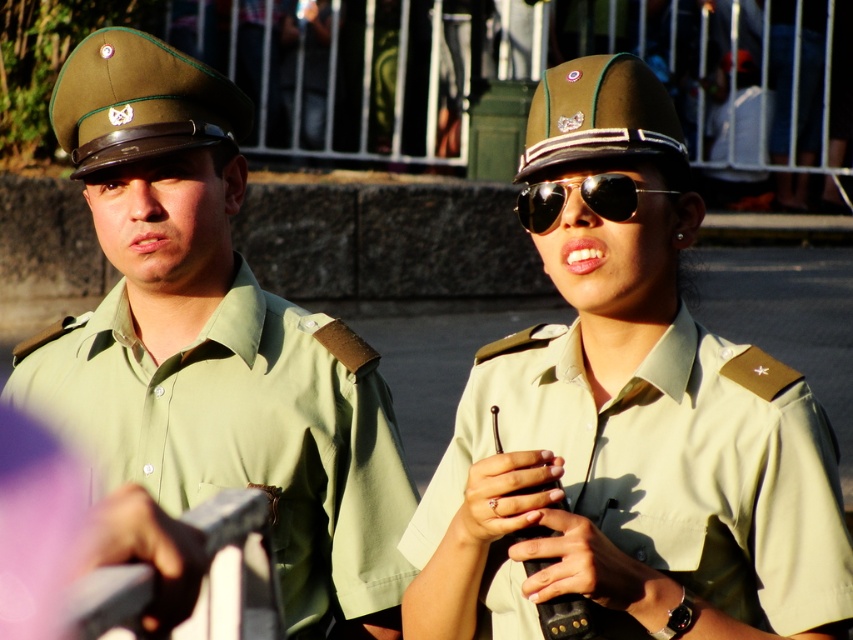
Question: Which point appears closest to the camera in this image?

Choices:
 (A) (543, 432)
 (B) (54, 408)

Answer: (A)

Question: Can you confirm if green uniform shirt at left is positioned to the right of khaki fabric uniform at right?

Choices:
 (A) yes
 (B) no

Answer: (B)

Question: Which point is farther to the camera?

Choices:
 (A) (318, 374)
 (B) (527, 227)
 (C) (509, 380)

Answer: (A)

Question: Which object is positioned closest to the khaki fabric uniform at right?

Choices:
 (A) gold reflective sunglasses at center
 (B) green uniform shirt at left

Answer: (A)

Question: Does green uniform shirt at left appear on the left side of khaki fabric uniform at right?

Choices:
 (A) yes
 (B) no

Answer: (A)

Question: Is green uniform shirt at left thinner than khaki fabric uniform at right?

Choices:
 (A) yes
 (B) no

Answer: (B)